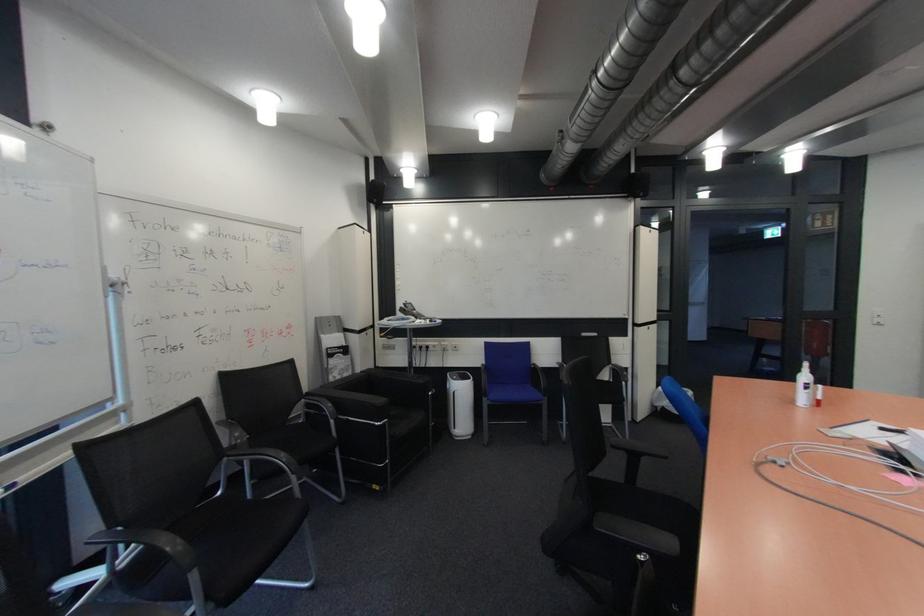
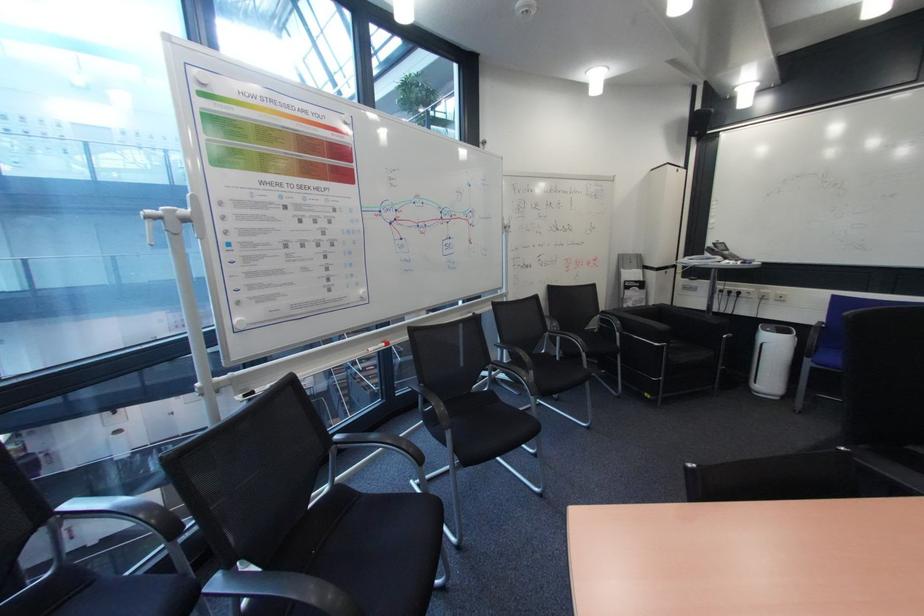
Question: Based on the continuous images, in which direction is the camera rotating? Reply with the corresponding letter.

Choices:
 (A) Left
 (B) Right
 (C) Up
 (D) Down

Answer: (A)